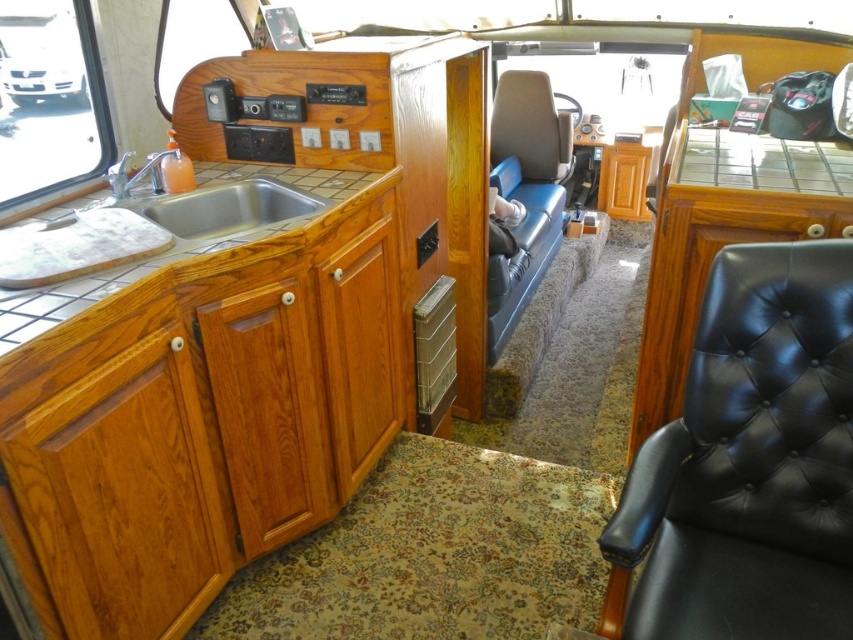
Is blue leather armchair at center positioned at the back of wooden drawer at center?

Yes, blue leather armchair at center is further from the viewer.

Can you confirm if blue leather armchair at center is smaller than wooden drawer at center?

No, blue leather armchair at center is not smaller than wooden drawer at center.

Who is more forward, (498, 269) or (363, 204)?

Point (363, 204) is in front.

Identify the location of blue leather armchair at center. (525, 192).

Which of these two, black leather armchair at right or wooden drawer at center, stands taller?

Standing taller between the two is black leather armchair at right.

Does black leather armchair at right appear over wooden drawer at center?

Actually, black leather armchair at right is below wooden drawer at center.

Does point (648, 534) come farther from viewer compared to point (345, 212)?

No, (648, 534) is in front of (345, 212).

The image size is (853, 640). I want to click on black leather armchair at right, so click(x=747, y=464).

Is polished stainless steel sink at left wider than wooden drawer at center?

Correct, the width of polished stainless steel sink at left exceeds that of wooden drawer at center.

Which is in front, point (213, 196) or point (332, 252)?

Point (332, 252)

Find the location of `polished stainless steel sink at left`. polished stainless steel sink at left is located at coordinates (225, 208).